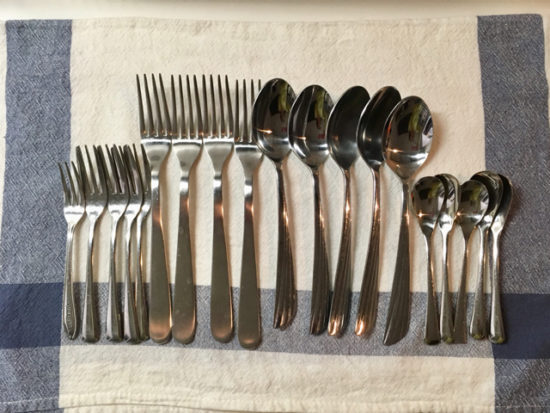
This screenshot has height=413, width=550. What are the coordinates of `small spoons` in the screenshot? It's located at (429, 201), (449, 202), (471, 202), (495, 182), (507, 208).